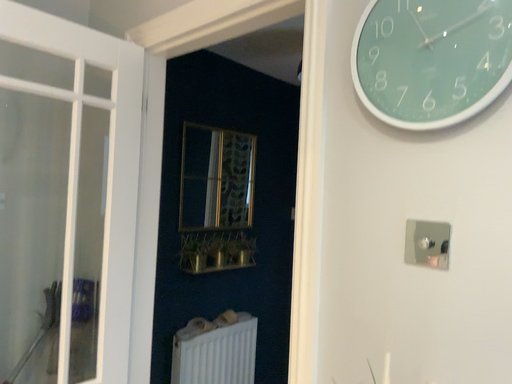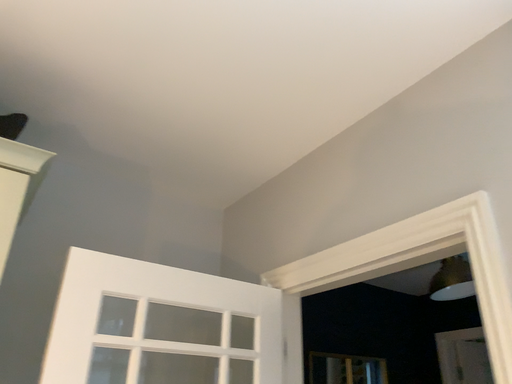
Question: How did the camera likely rotate when shooting the video?

Choices:
 (A) rotated left
 (B) rotated right

Answer: (A)